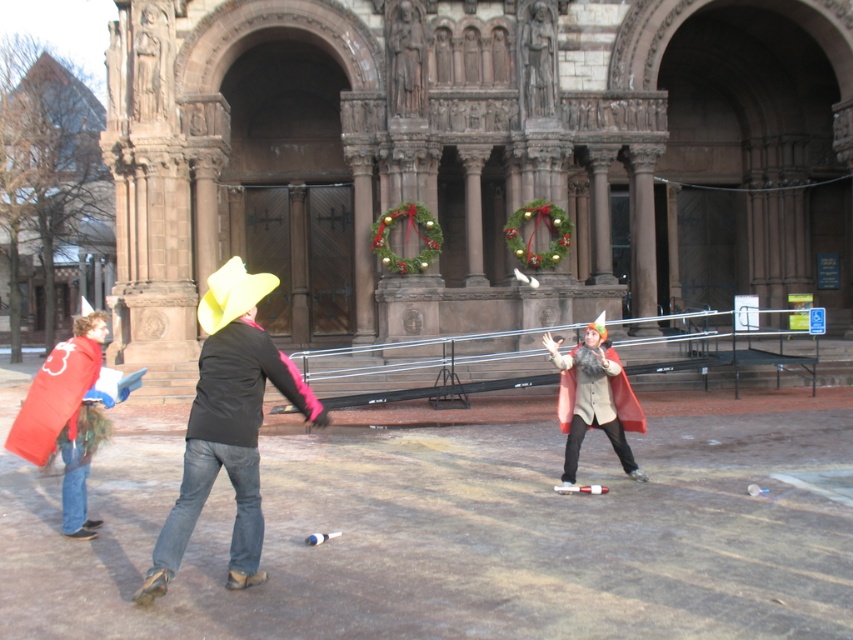
Is denim jeans at center positioned behind velvet red cape at center?

No.

Which is more to the left, denim jeans at center or velvet red cape at center?

denim jeans at center is more to the left.

Where is `denim jeans at center`? Image resolution: width=853 pixels, height=640 pixels. denim jeans at center is located at coordinates (228, 424).